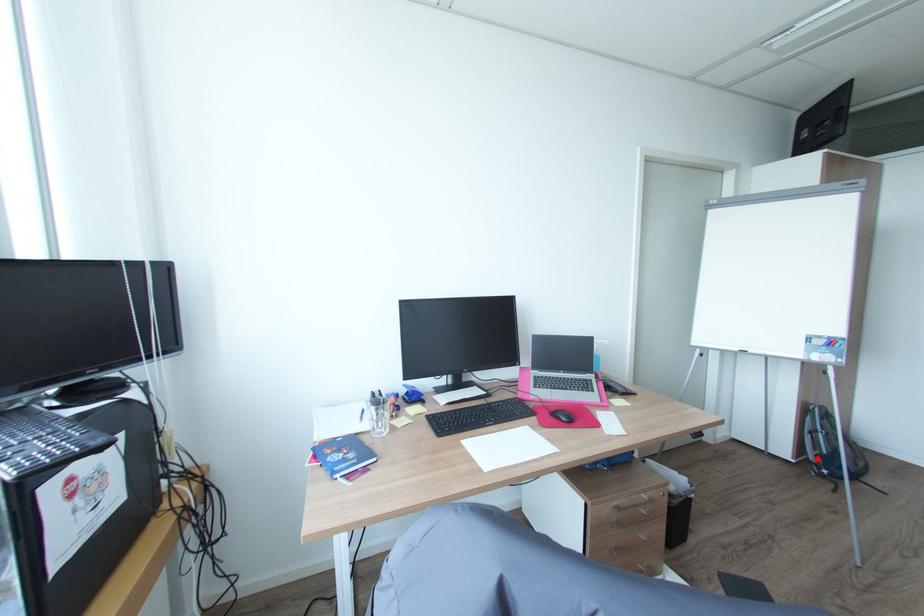
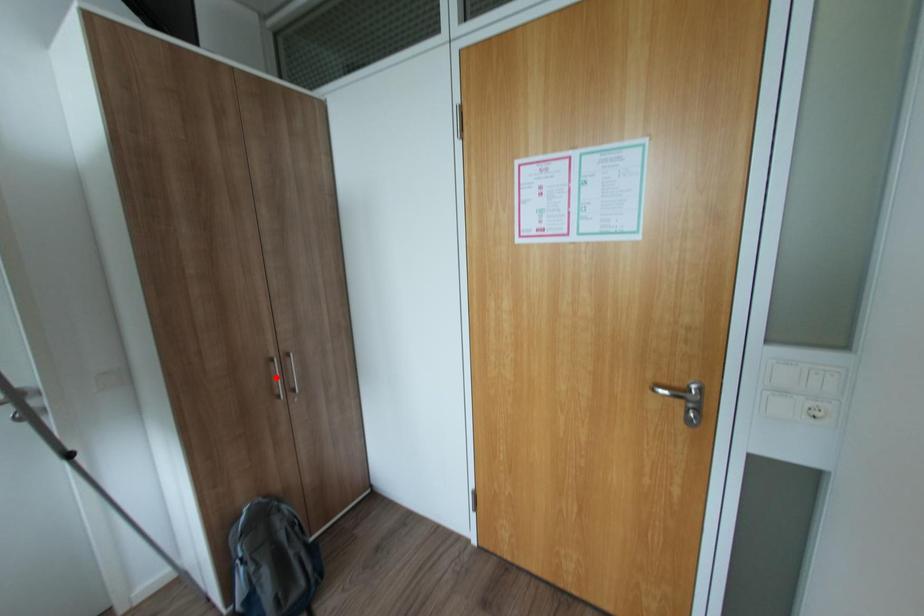
I am providing you with two images of the same scene from different viewpoints. A red point is marked on the first image and another point is marked on the second image. Are the points marked in image1 and image2 representing the same 3D position?

No